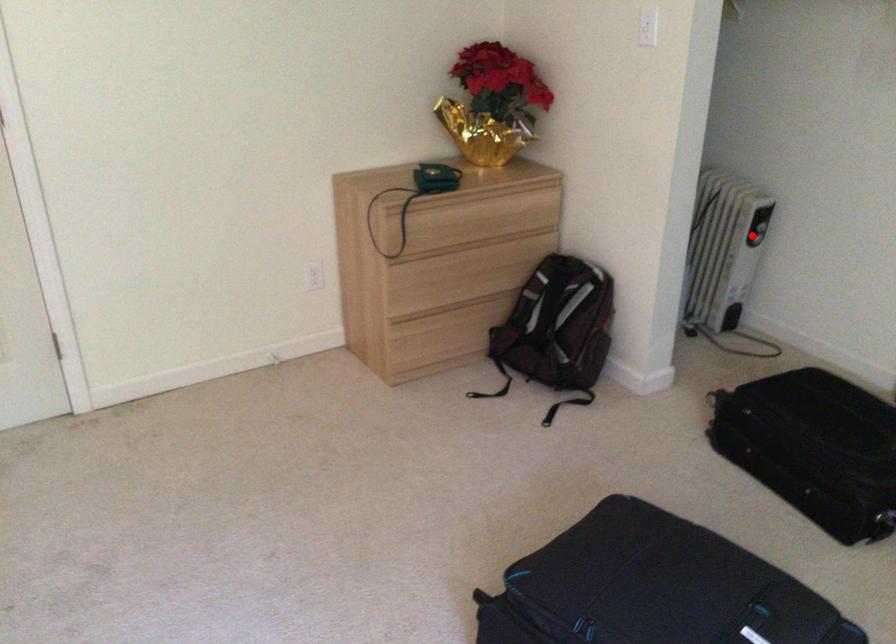
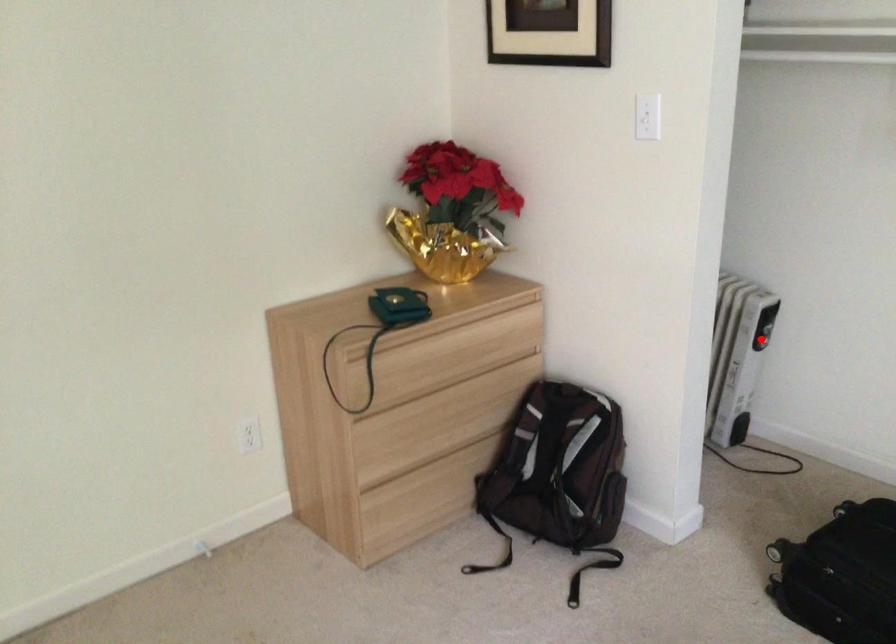
I am providing you with two images of the same scene from different viewpoints. A red point is marked on the first image and another point is marked on the second image. Is the red point in image1 aligned with the point shown in image2?

Yes